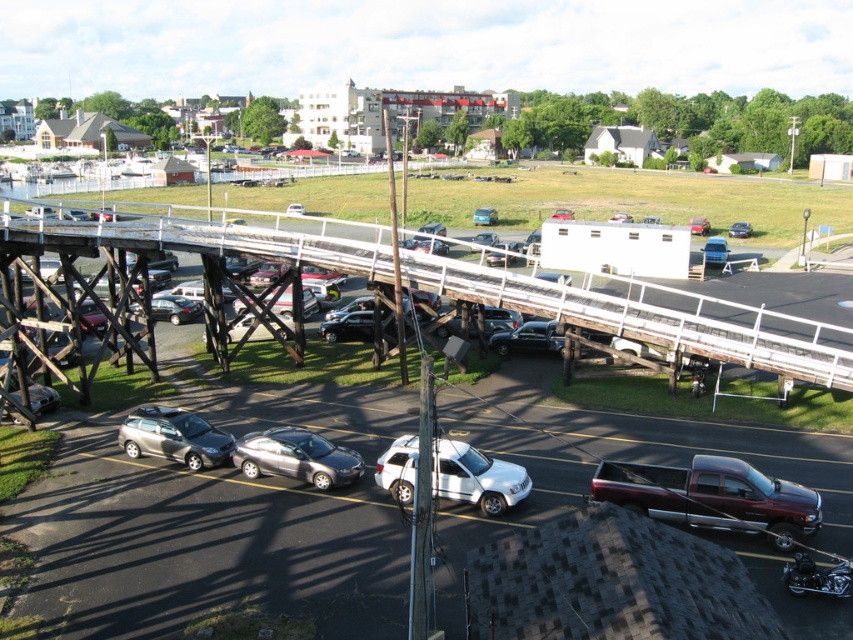
Does wooden bridge at center lie in front of metallic red car at center?

Yes.

Can you confirm if wooden bridge at center is positioned to the right of metallic red car at center?

In fact, wooden bridge at center is to the left of metallic red car at center.

Locate an element on the screen. This screenshot has height=640, width=853. wooden bridge at center is located at coordinates (654, 317).

Where is `wooden bridge at center`? This screenshot has height=640, width=853. wooden bridge at center is located at coordinates (654, 317).

Is point (236, 442) behind point (698, 218)?

No, (236, 442) is closer to viewer.

Does satin silver car at center appear on the left side of metallic red car at center?

Yes, satin silver car at center is to the left of metallic red car at center.

Locate an element on the screen. This screenshot has width=853, height=640. satin silver car at center is located at coordinates (296, 458).

The height and width of the screenshot is (640, 853). I want to click on satin silver car at center, so pos(296,458).

At what (x,y) coordinates should I click in order to perform the action: click on wooden bridge at center. Please return your answer as a coordinate pair (x, y). The image size is (853, 640). Looking at the image, I should click on (654, 317).

Can you confirm if wooden bridge at center is shorter than satin silver suv at lower left?

In fact, wooden bridge at center may be taller than satin silver suv at lower left.

Find the location of `wooden bridge at center`. wooden bridge at center is located at coordinates [654, 317].

Identify the location of wooden bridge at center. The height and width of the screenshot is (640, 853). (654, 317).